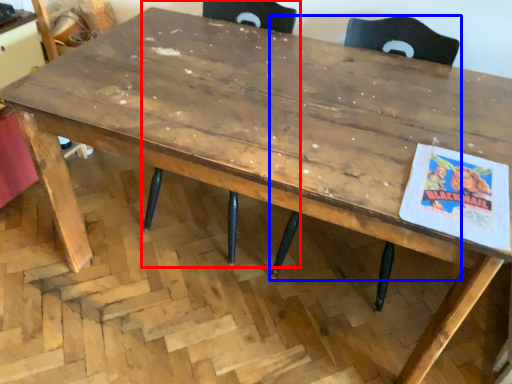
Question: Which point is further to the camera, chair (highlighted by a red box) or chair (highlighted by a blue box)?

Choices:
 (A) chair
 (B) chair

Answer: (A)